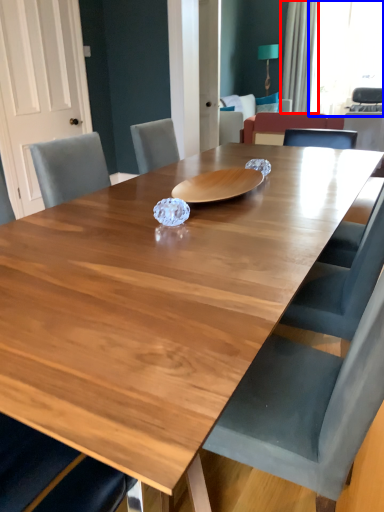
Question: Which object appears farthest to the camera in this image, curtain (highlighted by a red box) or window screen (highlighted by a blue box)?

Choices:
 (A) curtain
 (B) window screen

Answer: (B)